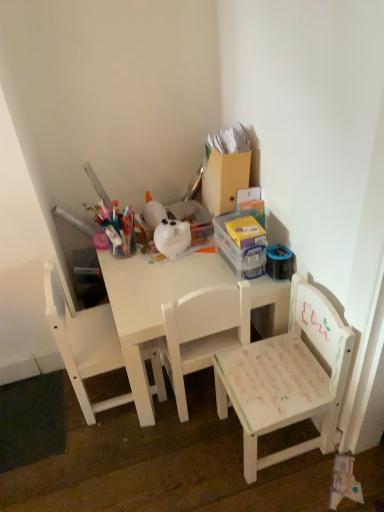
This screenshot has width=384, height=512. Find the location of `vacant area that is in front of white matte chair at center, the first chair from the left`. vacant area that is in front of white matte chair at center, the first chair from the left is located at coordinates (102, 448).